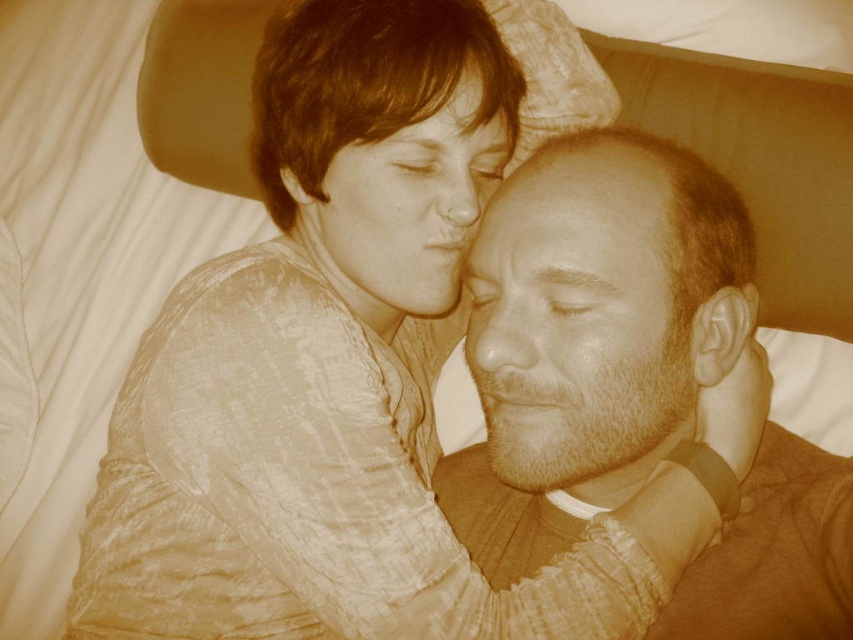
Between smooth brown shirt at center and beige textured skin at center, which one appears on the right side from the viewer's perspective?

smooth brown shirt at center

From the picture: Can you confirm if smooth brown shirt at center is smaller than beige textured skin at center?

No, smooth brown shirt at center is not smaller than beige textured skin at center.

Is point (735, 244) positioned after point (589, 355)?

Yes, it is behind point (589, 355).

Where is `smooth brown shirt at center`? smooth brown shirt at center is located at coordinates (590, 333).

Consider the image. Who is positioned more to the left, smooth brown shirt at center or smooth skin face at upper center?

From the viewer's perspective, smooth skin face at upper center appears more on the left side.

How much distance is there between smooth brown shirt at center and smooth skin face at upper center?

smooth brown shirt at center is 16.63 centimeters away from smooth skin face at upper center.

Which is behind, point (677, 252) or point (334, 195)?

The point (334, 195) is behind.

At what (x,y) coordinates should I click in order to perform the action: click on smooth brown shirt at center. Please return your answer as a coordinate pair (x, y). Image resolution: width=853 pixels, height=640 pixels. Looking at the image, I should click on (590, 333).

Does beige textured skin at center appear over smooth skin face at upper center?

Actually, beige textured skin at center is below smooth skin face at upper center.

Is point (575, 240) farther from camera compared to point (346, 304)?

No, it is in front of (346, 304).

Between point (674, 326) and point (408, 310), which one is positioned behind?

Point (408, 310)

At what (x,y) coordinates should I click in order to perform the action: click on beige textured skin at center. Please return your answer as a coordinate pair (x, y). This screenshot has width=853, height=640. Looking at the image, I should click on (577, 323).